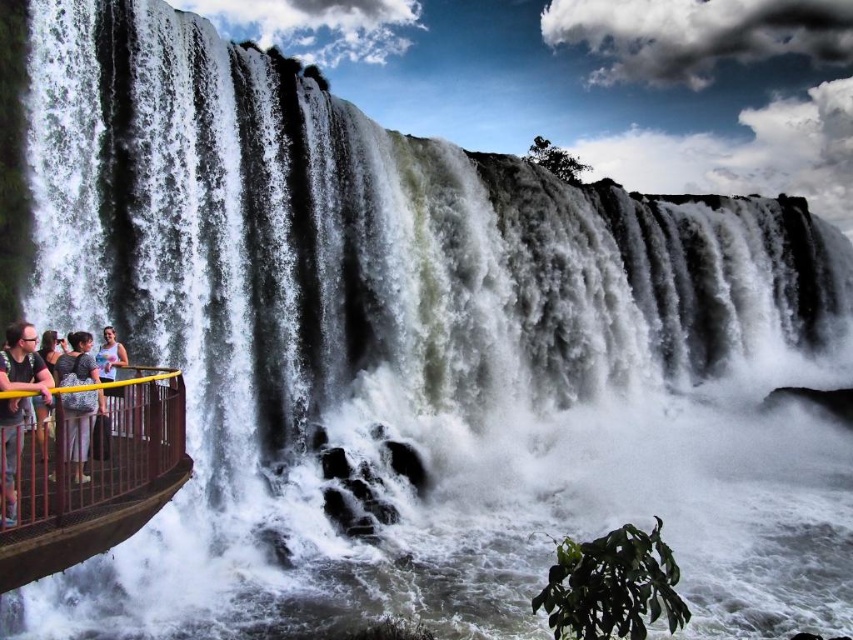
Question: From the image, what is the correct spatial relationship of yellow metal railing at lower left in relation to matte white tank top at left?

Choices:
 (A) above
 (B) below

Answer: (B)

Question: Which object appears closest to the camera in this image?

Choices:
 (A) yellow metal railing at lower left
 (B) gray fabric dress at lower left
 (C) matte black shirt at left

Answer: (A)

Question: Estimate the real-world distances between objects in this image. Which object is farther from the matte white tank top at left?

Choices:
 (A) matte gray shirt at left
 (B) yellow metal railing at lower left

Answer: (B)

Question: Can you confirm if yellow metal railing at lower left is positioned below matte black shirt at left?

Choices:
 (A) yes
 (B) no

Answer: (A)

Question: Based on their relative distances, which object is farther from the matte white tank top at left?

Choices:
 (A) gray fabric dress at lower left
 (B) matte gray shirt at left
 (C) matte black shirt at left

Answer: (C)

Question: Observing the image, what is the correct spatial positioning of yellow metal railing at lower left in reference to matte gray shirt at left?

Choices:
 (A) below
 (B) above

Answer: (A)